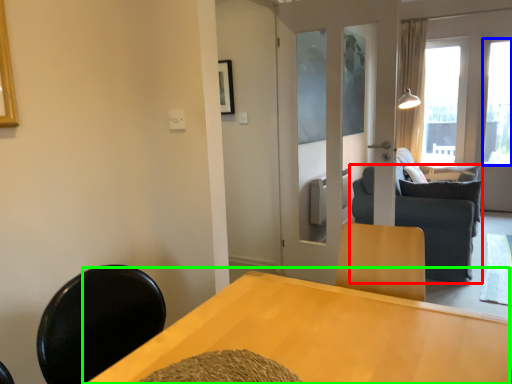
Question: Based on their relative distances, which object is farther from studio couch (highlighted by a red box)? Choose from window (highlighted by a blue box) and table (highlighted by a green box).

Choices:
 (A) window
 (B) table

Answer: (A)